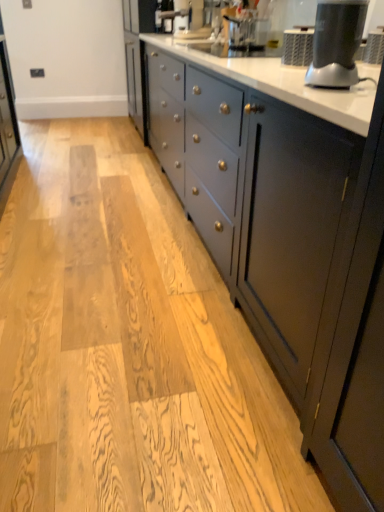
Describe the element at coordinates (289, 233) in the screenshot. Image resolution: width=384 pixels, height=512 pixels. I see `white glossy countertop at center` at that location.

The height and width of the screenshot is (512, 384). What do you see at coordinates (336, 42) in the screenshot? I see `matte black blender at upper right` at bounding box center [336, 42].

At what (x,y) coordinates should I click in order to perform the action: click on matte black coffee machine at upper center. Please return your answer as a coordinate pair (x, y). This screenshot has height=512, width=384. Looking at the image, I should click on (246, 32).

This screenshot has width=384, height=512. Find the location of `white glossy countertop at center`. white glossy countertop at center is located at coordinates (289, 233).

From a real-world perspective, is white glossy countertop at center physically located above or below matte black coffee machine at upper center?

white glossy countertop at center is below matte black coffee machine at upper center.

Based on the photo, between white glossy countertop at center and matte black coffee machine at upper center, which one has more height?

Standing taller between the two is white glossy countertop at center.

What's the angular difference between white glossy countertop at center and matte black coffee machine at upper center's facing directions?

white glossy countertop at center and matte black coffee machine at upper center are facing 0.161 degrees away from each other.

From the image's perspective, is white glossy countertop at center beneath matte black coffee machine at upper center?

Yes.

I want to click on home appliance above the white glossy countertop at center (from a real-world perspective), so click(336, 42).

Could you tell me if white glossy countertop at center is facing matte black blender at upper right?

No, white glossy countertop at center does not turn towards matte black blender at upper right.

From the image's perspective, is white glossy countertop at center above or below matte black blender at upper right?

white glossy countertop at center is above matte black blender at upper right.

Does white glossy countertop at center appear on the right side of matte black blender at upper right?

No, white glossy countertop at center is not to the right of matte black blender at upper right.

Considering the sizes of matte black blender at upper right and matte black coffee machine at upper center in the image, is matte black blender at upper right bigger or smaller than matte black coffee machine at upper center?

Clearly, matte black blender at upper right is smaller in size than matte black coffee machine at upper center.

Is matte black blender at upper right far from matte black coffee machine at upper center?

Absolutely, matte black blender at upper right is distant from matte black coffee machine at upper center.

Does matte black blender at upper right have a greater width compared to matte black coffee machine at upper center?

No.

Is matte black blender at upper right to the left or to the right of matte black coffee machine at upper center in the image?

In the image, matte black blender at upper right appears on the right side of matte black coffee machine at upper center.

Is matte black coffee machine at upper center bigger or smaller than matte black blender at upper right?

Considering their sizes, matte black coffee machine at upper center takes up more space than matte black blender at upper right.

Which is correct: matte black coffee machine at upper center is inside matte black blender at upper right, or outside of it?

matte black coffee machine at upper center exists outside the volume of matte black blender at upper right.

From a real-world perspective, does matte black coffee machine at upper center stand above matte black blender at upper right?

Yes, from a real-world perspective, matte black coffee machine at upper center is over matte black blender at upper right

Which is more to the right, matte black coffee machine at upper center or matte black blender at upper right?

From the viewer's perspective, matte black blender at upper right appears more on the right side.

Is matte black blender at upper right positioned far away from white glossy countertop at center?

That's not correct — matte black blender at upper right is a little close to white glossy countertop at center.

How far apart are matte black blender at upper right and white glossy countertop at center?

16.28 inches.

Which of these two, matte black blender at upper right or white glossy countertop at center, is smaller?

matte black blender at upper right is smaller.

Is matte black blender at upper right looking in the opposite direction of white glossy countertop at center?

No.

Is white glossy countertop at center a part of matte black coffee machine at upper center?

Definitely not — white glossy countertop at center is not inside matte black coffee machine at upper center.

Is matte black coffee machine at upper center not close to white glossy countertop at center?

matte black coffee machine at upper center is near white glossy countertop at center, not far away.

From the picture: From a real-world perspective, is matte black coffee machine at upper center physically located above or below white glossy countertop at center?

Clearly, from a real-world perspective, matte black coffee machine at upper center is above white glossy countertop at center.

Considering the sizes of objects matte black coffee machine at upper center and white glossy countertop at center in the image provided, who is bigger, matte black coffee machine at upper center or white glossy countertop at center?

Bigger between the two is white glossy countertop at center.

Locate an element on the screen. This screenshot has height=512, width=384. countertop beneath the matte black coffee machine at upper center (from a real-world perspective) is located at coordinates (289, 233).

This screenshot has height=512, width=384. What are the coordinates of `countertop on the left of matte black blender at upper right` in the screenshot? It's located at (289, 233).

Estimate the real-world distances between objects in this image. Which object is closer to matte black blender at upper right, white glossy countertop at center or matte black coffee machine at upper center?

white glossy countertop at center is closer to matte black blender at upper right.

When comparing their distances from white glossy countertop at center, does matte black blender at upper right or matte black coffee machine at upper center seem further?

matte black coffee machine at upper center lies further to white glossy countertop at center than the other object.

Considering their positions, is white glossy countertop at center positioned further to matte black coffee machine at upper center than matte black blender at upper right?

matte black blender at upper right lies further to matte black coffee machine at upper center than the other object.

Which object lies further to the anchor point white glossy countertop at center, matte black coffee machine at upper center or matte black blender at upper right?

matte black coffee machine at upper center is further to white glossy countertop at center.

Looking at the image, which one is located closer to matte black blender at upper right, matte black coffee machine at upper center or white glossy countertop at center?

white glossy countertop at center is positioned closer to the anchor matte black blender at upper right.

Estimate the real-world distances between objects in this image. Which object is further from matte black coffee machine at upper center, matte black blender at upper right or white glossy countertop at center?

matte black blender at upper right is further to matte black coffee machine at upper center.

You are a GUI agent. You are given a task and a screenshot of the screen. Output one action in this format:
    pyautogui.click(x=<x>, y=<y>)
    Task: Click on the home appliance between white glossy countertop at center and matte black coffee machine at upper center in the front-back direction
    The height and width of the screenshot is (512, 384).
    Given the screenshot: What is the action you would take?
    pyautogui.click(x=336, y=42)